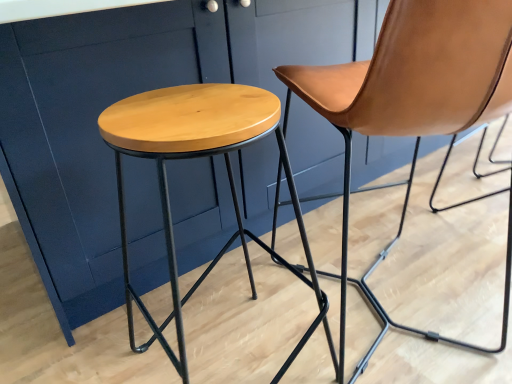
Question: From the image's perspective, is natural wood stool at center under brown leather chair at center?

Choices:
 (A) yes
 (B) no

Answer: (A)

Question: Is natural wood stool at center taller than brown leather chair at center?

Choices:
 (A) no
 (B) yes

Answer: (A)

Question: Is natural wood stool at center behind brown leather chair at center?

Choices:
 (A) no
 (B) yes

Answer: (A)

Question: Is natural wood stool at center positioned in front of brown leather chair at center?

Choices:
 (A) yes
 (B) no

Answer: (A)

Question: Can you confirm if natural wood stool at center is smaller than brown leather chair at center?

Choices:
 (A) no
 (B) yes

Answer: (B)

Question: Could you tell me if natural wood stool at center is facing brown leather chair at center?

Choices:
 (A) yes
 (B) no

Answer: (B)

Question: Could you tell me if brown leather chair at center is facing natural wood stool at center?

Choices:
 (A) no
 (B) yes

Answer: (A)

Question: Can you confirm if brown leather chair at center is thinner than natural wood stool at center?

Choices:
 (A) yes
 (B) no

Answer: (B)

Question: Considering the relative sizes of brown leather chair at center and natural wood stool at center in the image provided, is brown leather chair at center shorter than natural wood stool at center?

Choices:
 (A) no
 (B) yes

Answer: (A)

Question: Is natural wood stool at center located within brown leather chair at center?

Choices:
 (A) yes
 (B) no

Answer: (B)

Question: Does brown leather chair at center touch natural wood stool at center?

Choices:
 (A) yes
 (B) no

Answer: (B)

Question: Can you confirm if brown leather chair at center is smaller than natural wood stool at center?

Choices:
 (A) yes
 (B) no

Answer: (B)

Question: Based on their sizes in the image, would you say brown leather chair at center is bigger or smaller than natural wood stool at center?

Choices:
 (A) big
 (B) small

Answer: (A)